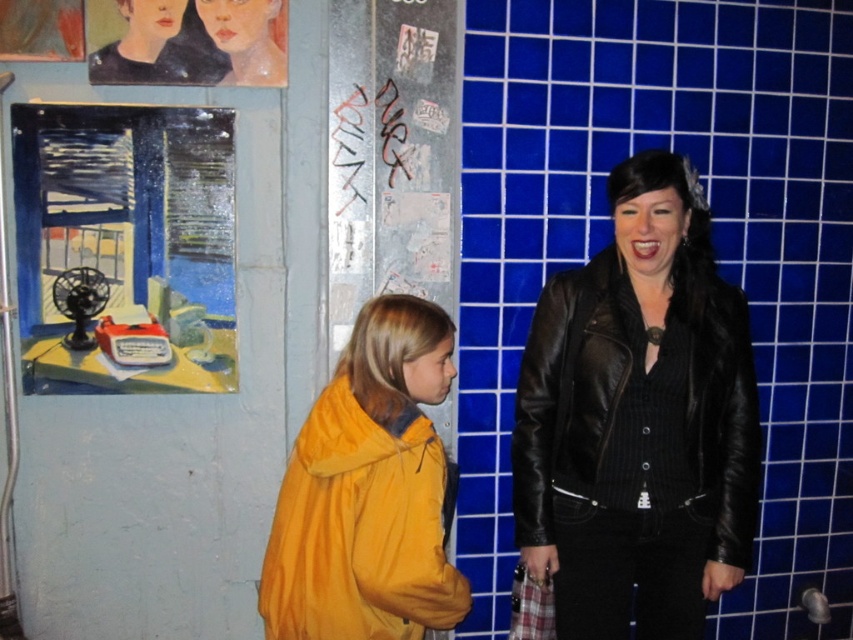
Does point (318, 413) come behind point (560, 342)?

That is False.

Is yellow matte jacket at center closer to the viewer compared to black leather jacket at right?

Yes, yellow matte jacket at center is closer to the viewer.

Locate an element on the screen. Image resolution: width=853 pixels, height=640 pixels. yellow matte jacket at center is located at coordinates (368, 492).

The image size is (853, 640). Find the location of `yellow matte jacket at center`. yellow matte jacket at center is located at coordinates (368, 492).